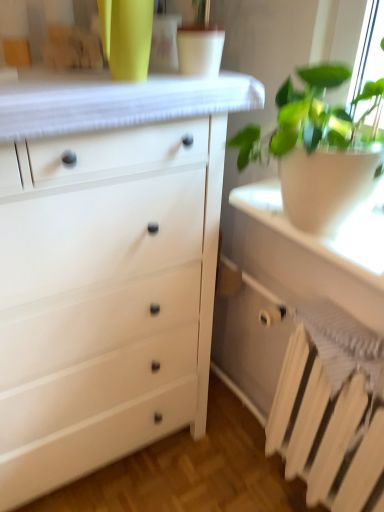
Question: From the image's perspective, is white matte chest of drawers at left above or below white painted metal radiator at lower right?

Choices:
 (A) below
 (B) above

Answer: (B)

Question: In terms of height, does white matte chest of drawers at left look taller or shorter compared to white painted metal radiator at lower right?

Choices:
 (A) short
 (B) tall

Answer: (B)

Question: Which of these objects is positioned closest to the white textured fabric at upper center?

Choices:
 (A) white matte radiator at lower right
 (B) white matte chest of drawers at left
 (C) white painted metal radiator at lower right
 (D) white matte pot at right

Answer: (D)

Question: Which is nearer to the white matte chest of drawers at left?

Choices:
 (A) white textured fabric at upper center
 (B) white matte radiator at lower right
 (C) white matte pot at right
 (D) white painted metal radiator at lower right

Answer: (A)